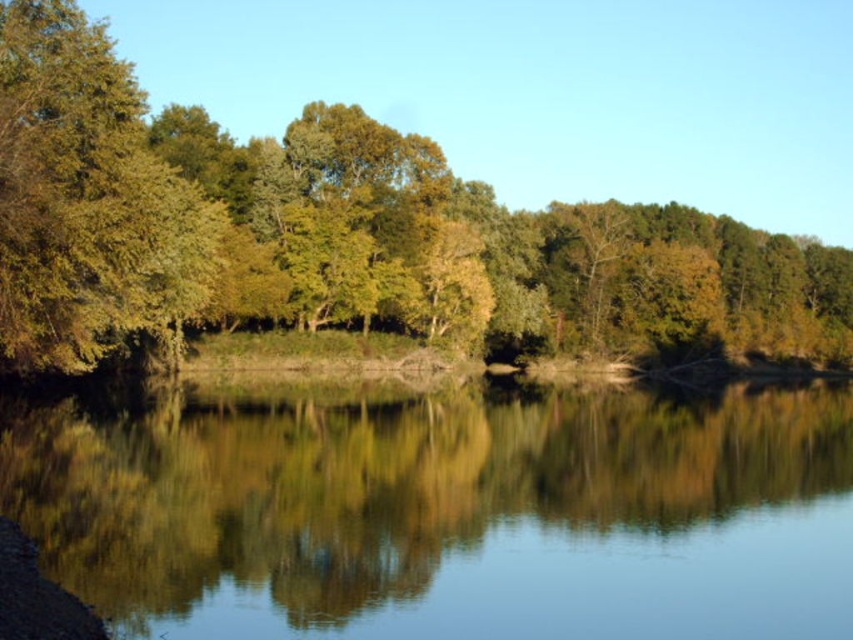
You are standing at the edge of the scene and want to take a photo of the clear water at center and the green leafy trees at center. Which object should you focus on first to ensure both are in the frame?

You should focus on the green leafy trees at center first because the clear water at center is located below it, so adjusting the camera angle to include both would require framing from the top down.

You are standing at the edge of the serene landscape and notice the clear water at center and the green leafy trees at center. Which object appears taller from your viewpoint?

The green leafy trees at center appear taller than the clear water at center from your viewpoint.